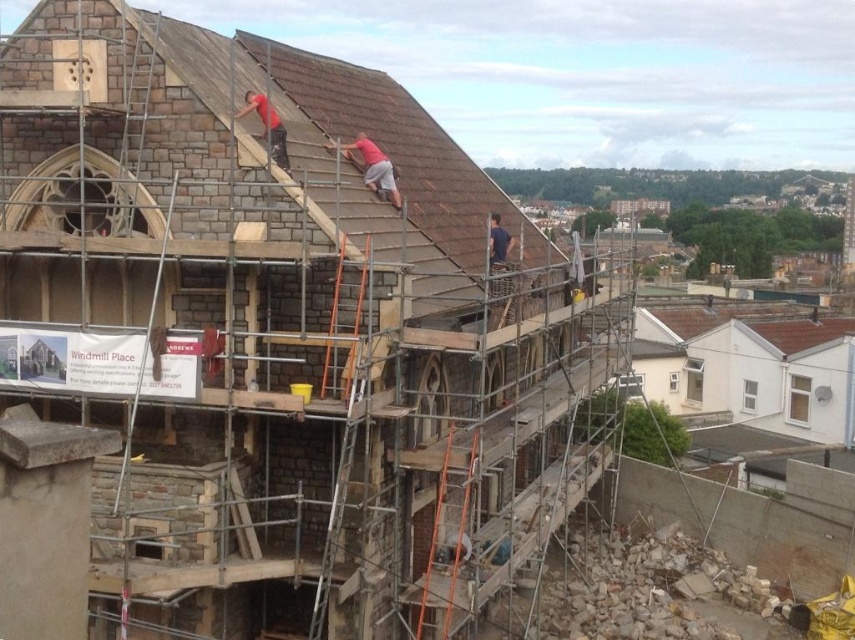
Question: Considering the relative positions of matte red shirt at upper center and red matte shirt at upper center in the image provided, where is matte red shirt at upper center located with respect to red matte shirt at upper center?

Choices:
 (A) below
 (B) above

Answer: (A)

Question: Is matte red shirt at upper center closer to the viewer compared to red matte shirt at upper center?

Choices:
 (A) yes
 (B) no

Answer: (B)

Question: Estimate the real-world distances between objects in this image. Which object is farther from the red matte shirt at upper center?

Choices:
 (A) matte red shirt at upper center
 (B) brown tile roof at upper center

Answer: (B)

Question: Estimate the real-world distances between objects in this image. Which object is farther from the brown tile roof at upper center?

Choices:
 (A) red matte shirt at upper center
 (B) matte red shirt at upper center

Answer: (A)

Question: Which object is farther from the camera taking this photo?

Choices:
 (A) brown tile roof at upper center
 (B) matte red shirt at upper center
 (C) red matte shirt at upper center

Answer: (B)

Question: In this image, where is matte red shirt at upper center located relative to red matte shirt at upper center?

Choices:
 (A) above
 (B) below

Answer: (B)